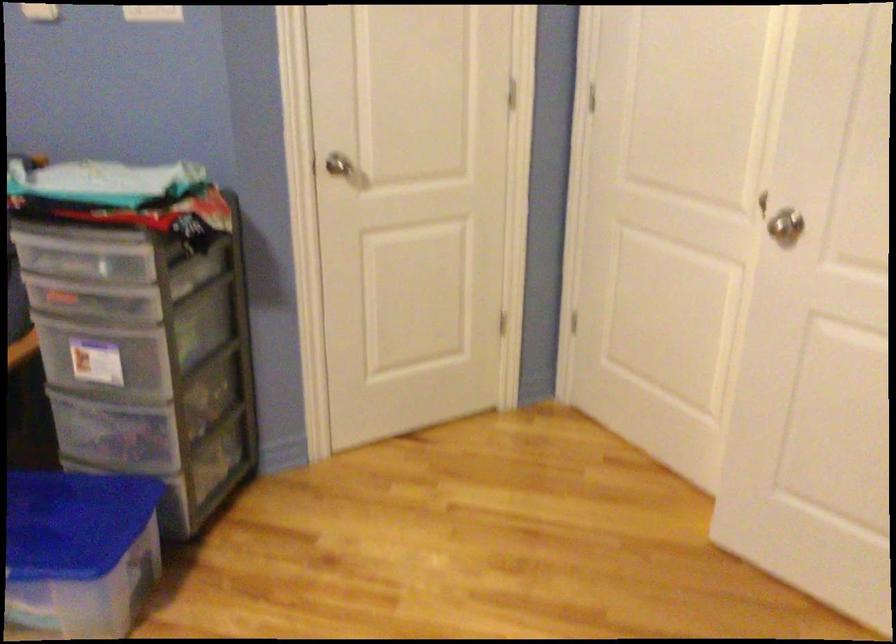
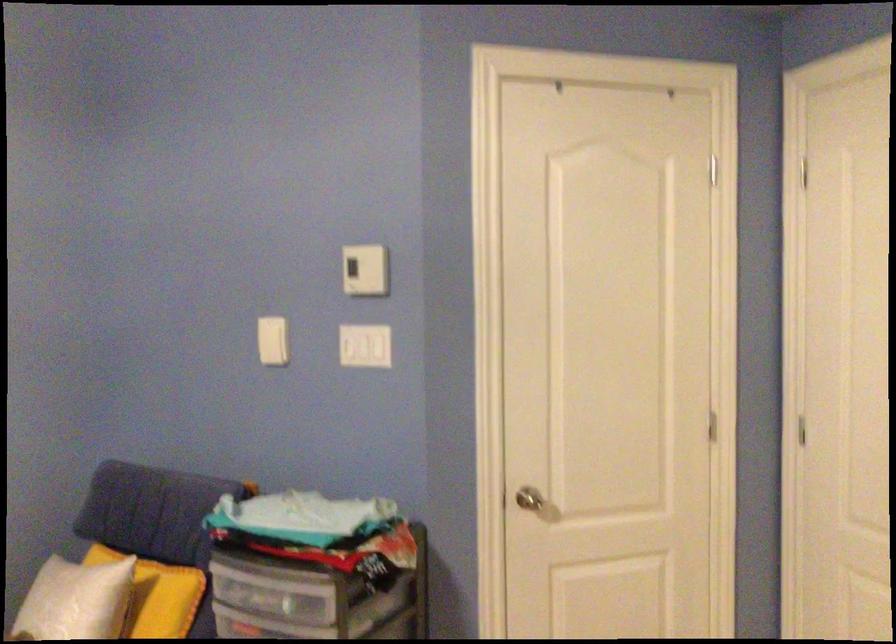
What movement of the cameraman would produce the second image?

The cameraman moved toward right, forward.